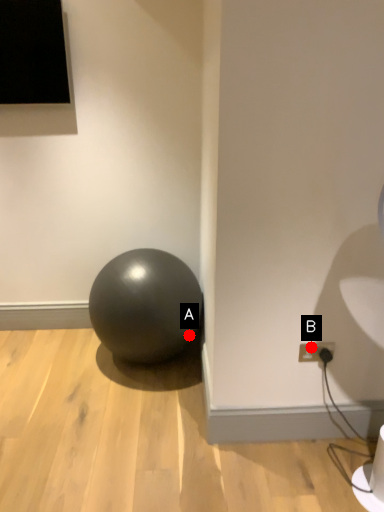
Question: Two points are circled on the image, labeled by A and B beside each circle. Among these points, which one is nearest to the camera?

Choices:
 (A) A is closer
 (B) B is closer

Answer: (B)